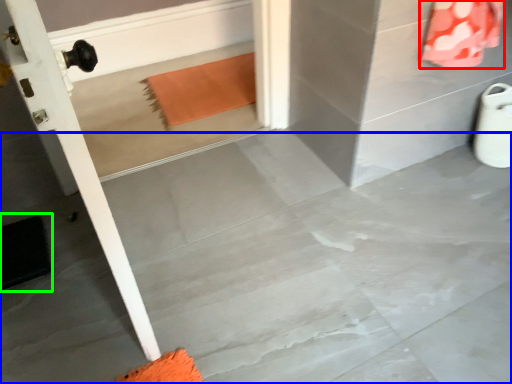
Question: Considering the real-world distances, which object is closest to material (highlighted by a red box)? concrete (highlighted by a blue box) or doormat (highlighted by a green box).

Choices:
 (A) concrete
 (B) doormat

Answer: (A)